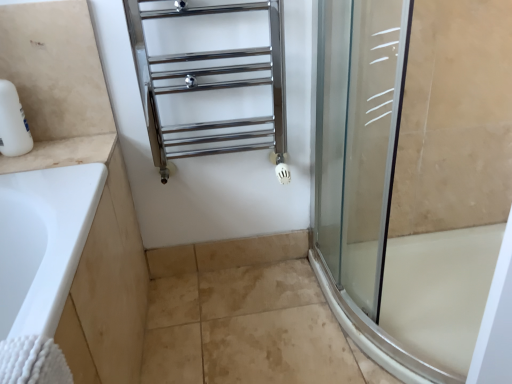
Question: From the image's perspective, is polished chrome towel rack at upper center located beneath white marble counter at left?

Choices:
 (A) no
 (B) yes

Answer: (A)

Question: From a real-world perspective, is polished chrome towel rack at upper center positioned under white marble counter at left based on gravity?

Choices:
 (A) yes
 (B) no

Answer: (B)

Question: Can you confirm if polished chrome towel rack at upper center is wider than white marble counter at left?

Choices:
 (A) no
 (B) yes

Answer: (A)

Question: Does polished chrome towel rack at upper center appear on the right side of white marble counter at left?

Choices:
 (A) yes
 (B) no

Answer: (A)

Question: Does polished chrome towel rack at upper center have a smaller size compared to white marble counter at left?

Choices:
 (A) yes
 (B) no

Answer: (B)

Question: Choose the correct answer: Is beige tile at lower center inside white marble counter at left or outside it?

Choices:
 (A) outside
 (B) inside

Answer: (A)

Question: In the image, is beige tile at lower center positioned in front of or behind white marble counter at left?

Choices:
 (A) behind
 (B) front

Answer: (A)

Question: Is point (287, 236) positioned closer to the camera than point (40, 147)?

Choices:
 (A) farther
 (B) closer

Answer: (A)

Question: Based on their sizes in the image, would you say beige tile at lower center is bigger or smaller than white marble counter at left?

Choices:
 (A) small
 (B) big

Answer: (A)

Question: From a real-world perspective, is polished chrome towel rack at upper center above or below white marble counter at left?

Choices:
 (A) above
 (B) below

Answer: (A)

Question: Looking at the image, does polished chrome towel rack at upper center seem bigger or smaller compared to white marble counter at left?

Choices:
 (A) big
 (B) small

Answer: (A)

Question: Is polished chrome towel rack at upper center situated inside white marble counter at left or outside?

Choices:
 (A) inside
 (B) outside

Answer: (B)

Question: Considering their positions, is polished chrome towel rack at upper center located in front of or behind white marble counter at left?

Choices:
 (A) front
 (B) behind

Answer: (A)

Question: Considering their positions, is white marble counter at left located in front of or behind polished chrome towel rack at upper center?

Choices:
 (A) front
 (B) behind

Answer: (B)

Question: Is white marble counter at left taller or shorter than polished chrome towel rack at upper center?

Choices:
 (A) tall
 (B) short

Answer: (B)